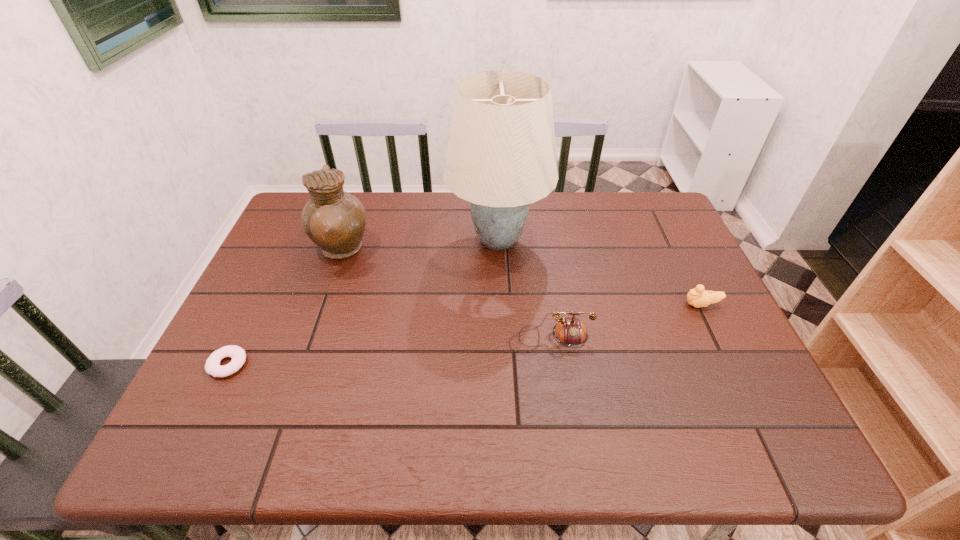
Where is `object present at the far left corner`? object present at the far left corner is located at coordinates (335, 220).

In the image, there is a desktop. Where is `free space at the far edge`? The height and width of the screenshot is (540, 960). free space at the far edge is located at coordinates (405, 200).

Where is `free location at the near edge of the desktop`? The width and height of the screenshot is (960, 540). free location at the near edge of the desktop is located at coordinates (371, 429).

I want to click on vacant space at the right edge of the desktop, so click(658, 300).

Image resolution: width=960 pixels, height=540 pixels. I want to click on vacant area at the far right corner of the desktop, so click(634, 213).

What are the coordinates of `free space between the fourth object from right to left and the lampshade` in the screenshot? It's located at pyautogui.click(x=420, y=246).

The width and height of the screenshot is (960, 540). Find the location of `free space between the shortest object and the duckling`. free space between the shortest object and the duckling is located at coordinates pyautogui.click(x=465, y=334).

You are a GUI agent. You are given a task and a screenshot of the screen. Output one action in this format:
    pyautogui.click(x=<x>, y=<y>)
    Task: Click on the empty space between the leftmost object and the tallest object
    
    Given the screenshot: What is the action you would take?
    pyautogui.click(x=363, y=302)

Where is `free space between the telephone and the lampshade`? The image size is (960, 540). free space between the telephone and the lampshade is located at coordinates (524, 289).

At what (x,y) coordinates should I click in order to perform the action: click on free space that is in between the fourth object from right to left and the doughnut. Please return your answer as a coordinate pair (x, y). The width and height of the screenshot is (960, 540). Looking at the image, I should click on (284, 307).